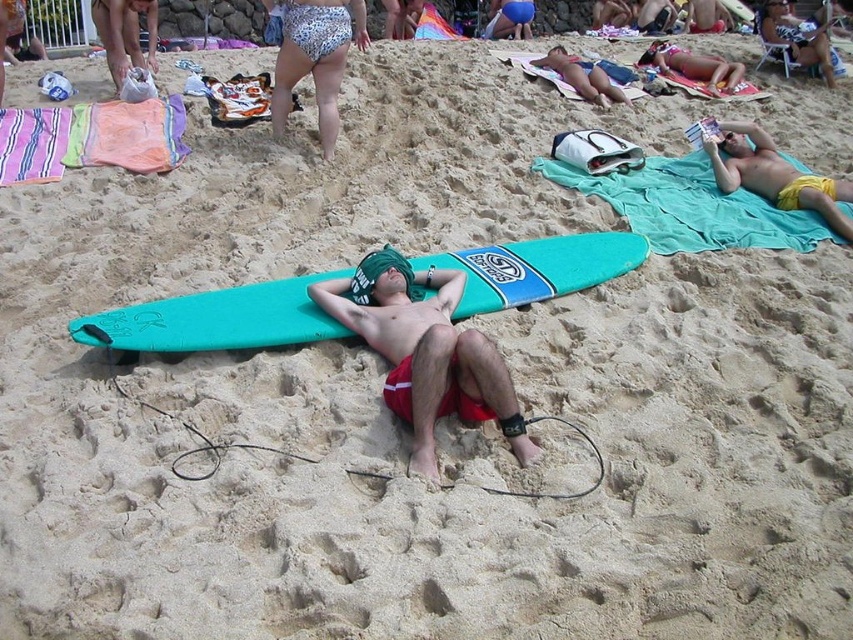
You are a beachgoer who wants to know which item is smaller between the teal matte surfboard at center and the yellow fabric towel at upper right. Can you help me determine that?

The teal matte surfboard at center has a smaller size compared to the yellow fabric towel at upper right, so the teal matte surfboard at center is the smaller item.

You are a beachgoer who wants to place your new beach bag on the nearest available towel. You are currently standing at the center of the beach scene. Which towel should you choose between the matte green towel at center and the teal fabric towel at upper right?

The matte green towel at center is closer to you since it is located at the center of the scene, whereas the teal fabric towel at upper right is positioned higher up. Therefore, you should choose the matte green towel at center to place your beach bag.

You are a beachgoer who wants to know which object is taller between the teal matte surfboard at center and the yellow fabric towel at upper right. Can you tell me which one is taller?

The teal matte surfboard at center has a lesser height compared to yellow fabric towel at upper right, so the yellow fabric towel at upper right is taller.